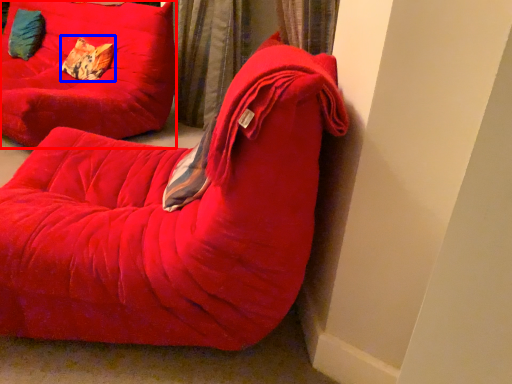
Question: Which point is closer to the camera, furniture (highlighted by a red box) or pillow (highlighted by a blue box)?

Choices:
 (A) furniture
 (B) pillow

Answer: (A)